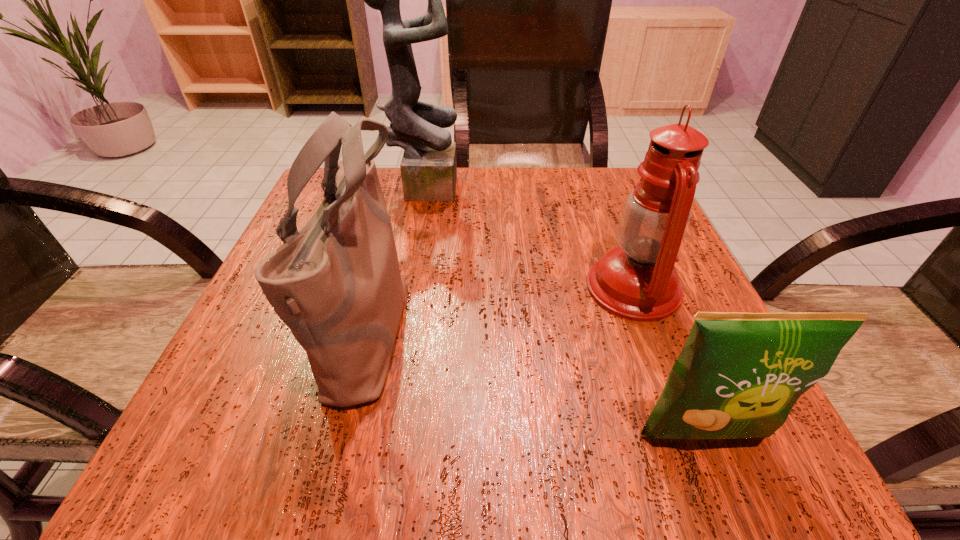
Where is `free space between the oil lamp and the crisp (potato chip)`? This screenshot has height=540, width=960. free space between the oil lamp and the crisp (potato chip) is located at coordinates (668, 361).

At what (x,y) coordinates should I click in order to perform the action: click on vacant area that lies between the crisp (potato chip) and the tallest object. Please return your answer as a coordinate pair (x, y). Looking at the image, I should click on [x=564, y=309].

This screenshot has height=540, width=960. What are the coordinates of `unoccupied area between the oil lamp and the sculpture` in the screenshot? It's located at (529, 236).

The width and height of the screenshot is (960, 540). I want to click on free point between the oil lamp and the tallest object, so click(529, 236).

Find the location of a particular element. vacant space in between the oil lamp and the shoulder bag is located at coordinates (501, 307).

Identify the location of vacant region between the shoulder bag and the oil lamp. The height and width of the screenshot is (540, 960). (501, 307).

Locate an element on the screen. The width and height of the screenshot is (960, 540). vacant area that lies between the oil lamp and the shortest object is located at coordinates (668, 361).

Where is `blank region between the crisp (potato chip) and the shoulder bag`? The width and height of the screenshot is (960, 540). blank region between the crisp (potato chip) and the shoulder bag is located at coordinates (536, 381).

At what (x,y) coordinates should I click in order to perform the action: click on free space between the oil lamp and the farthest object. Please return your answer as a coordinate pair (x, y). Looking at the image, I should click on click(529, 236).

At what (x,y) coordinates should I click in order to perform the action: click on vacant region between the oil lamp and the tallest object. Please return your answer as a coordinate pair (x, y). The height and width of the screenshot is (540, 960). Looking at the image, I should click on (529, 236).